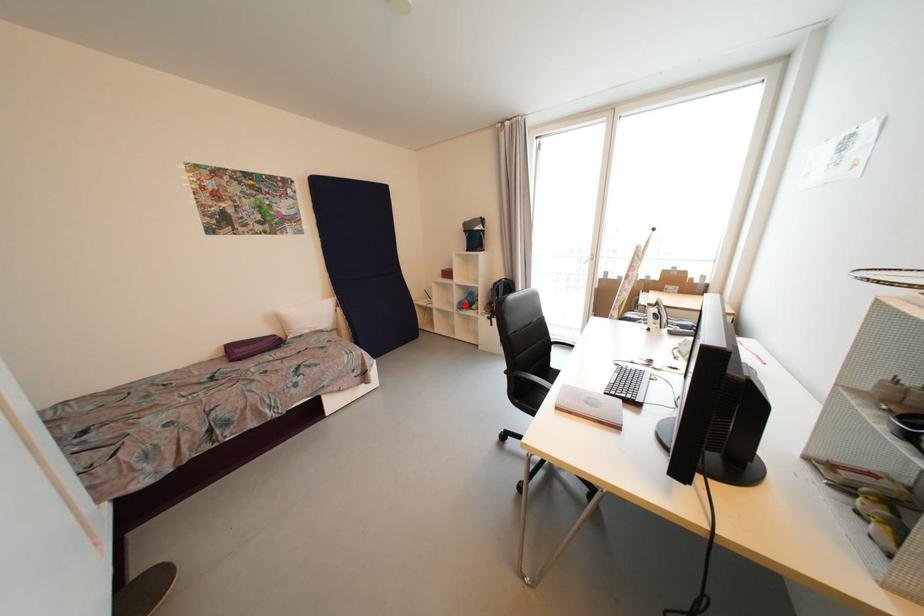
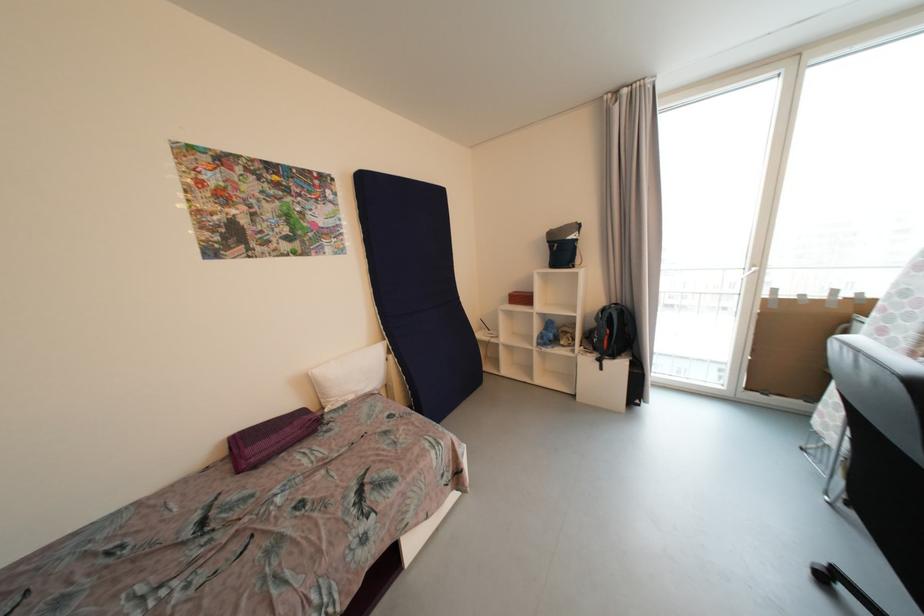
Find the pixel in the second image that matches the highlighted location in the first image.

(545, 339)